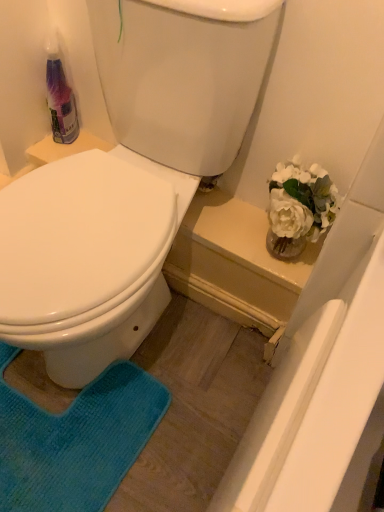
I want to click on free space in front of translucent plastic bottle at upper left, so click(46, 150).